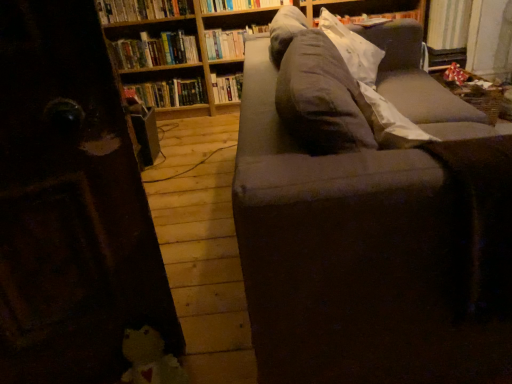
Question: Considering the relative sizes of wooden bookcase at upper center and hardcover book at upper center, the second book when ordered from bottom to top, in the image provided, is wooden bookcase at upper center wider than hardcover book at upper center, the second book when ordered from bottom to top,?

Choices:
 (A) no
 (B) yes

Answer: (B)

Question: From the image's perspective, is wooden bookcase at upper center located beneath hardcover book at upper center, which is the 5th book from top to bottom?

Choices:
 (A) yes
 (B) no

Answer: (B)

Question: Would you say wooden bookcase at upper center is outside hardcover book at upper center, the second book when ordered from bottom to top?

Choices:
 (A) yes
 (B) no

Answer: (A)

Question: Does wooden bookcase at upper center appear on the left side of hardcover book at upper center, the second book when ordered from bottom to top?

Choices:
 (A) no
 (B) yes

Answer: (A)

Question: Does wooden bookcase at upper center have a smaller size compared to hardcover book at upper center, which is the 5th book from top to bottom?

Choices:
 (A) no
 (B) yes

Answer: (A)

Question: From a real-world perspective, is wooden bookcase at upper center on top of hardcover book at upper center, the second book when ordered from bottom to top?

Choices:
 (A) no
 (B) yes

Answer: (B)

Question: Is hardcover book at upper center, the 4th book in the bottom-to-top sequence, not within gray fabric pillow at upper right?

Choices:
 (A) no
 (B) yes

Answer: (B)

Question: Can you confirm if hardcover book at upper center, the 4th book in the bottom-to-top sequence, is positioned to the right of gray fabric pillow at upper right?

Choices:
 (A) no
 (B) yes

Answer: (A)

Question: Would you say gray fabric pillow at upper right is part of hardcover book at upper center, the 4th book in the bottom-to-top sequence,'s contents?

Choices:
 (A) no
 (B) yes

Answer: (A)

Question: Considering the relative sizes of hardcover book at upper center, the third book when ordered from top to bottom, and gray fabric pillow at upper right in the image provided, is hardcover book at upper center, the third book when ordered from top to bottom, smaller than gray fabric pillow at upper right?

Choices:
 (A) yes
 (B) no

Answer: (A)

Question: From a real-world perspective, is hardcover book at upper center, the 4th book in the bottom-to-top sequence, located beneath gray fabric pillow at upper right?

Choices:
 (A) no
 (B) yes

Answer: (B)

Question: Can you confirm if hardcover book at upper center, the 4th book in the bottom-to-top sequence, is bigger than gray fabric pillow at upper right?

Choices:
 (A) no
 (B) yes

Answer: (A)

Question: Considering the relative sizes of hardcover books at upper left, the second book from the top, and hardcover book at center, positioned as the first book in bottom-to-top order, in the image provided, is hardcover books at upper left, the second book from the top, taller than hardcover book at center, positioned as the first book in bottom-to-top order,?

Choices:
 (A) no
 (B) yes

Answer: (A)